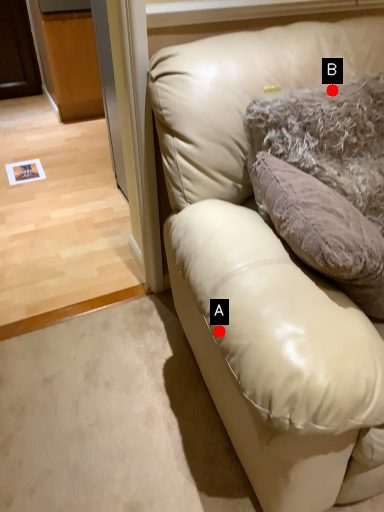
Question: Two points are circled on the image, labeled by A and B beside each circle. Which of the following is the farthest from the observer?

Choices:
 (A) A is further
 (B) B is further

Answer: (B)